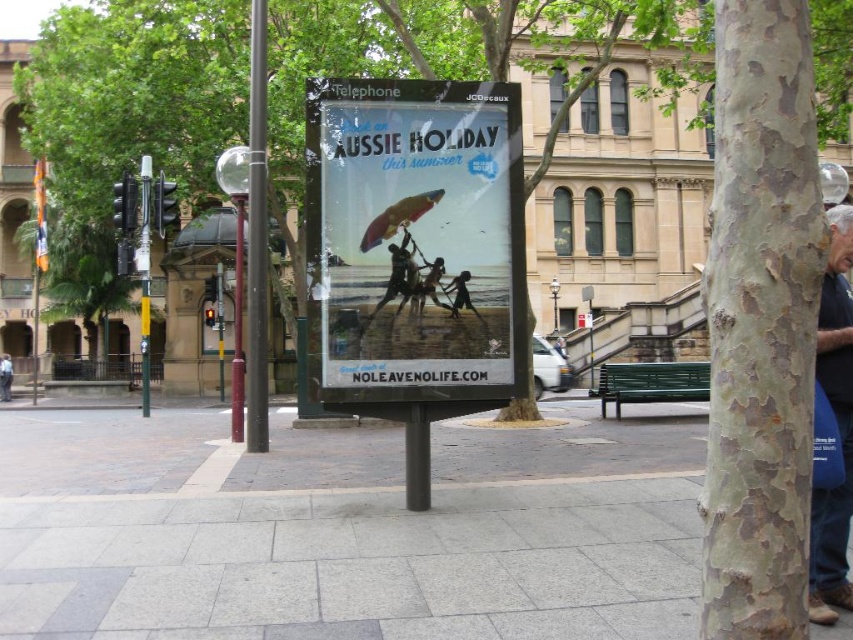
Can you confirm if gray textured bark at right is bigger than matte black surfboard at center?

Indeed, gray textured bark at right has a larger size compared to matte black surfboard at center.

Which is in front, point (802, 346) or point (445, 304)?

Point (802, 346)

Which is in front, point (757, 634) or point (436, 273)?

Point (757, 634)

Image resolution: width=853 pixels, height=640 pixels. I want to click on gray textured bark at right, so click(759, 323).

Does point (42, 96) lie in front of point (503, 330)?

No.

Between point (90, 170) and point (386, 326), which one is positioned in front?

Positioned in front is point (386, 326).

This screenshot has height=640, width=853. Find the location of `smooth bark tree at center`. smooth bark tree at center is located at coordinates (477, 51).

Measure the distance from dark blue shirt at right to green leafy tree at left.

dark blue shirt at right and green leafy tree at left are 31.87 meters apart from each other.

Does point (834, 339) lie in front of point (78, 378)?

Yes, it is.

This screenshot has height=640, width=853. Find the location of `dark blue shirt at right`. dark blue shirt at right is located at coordinates (837, 428).